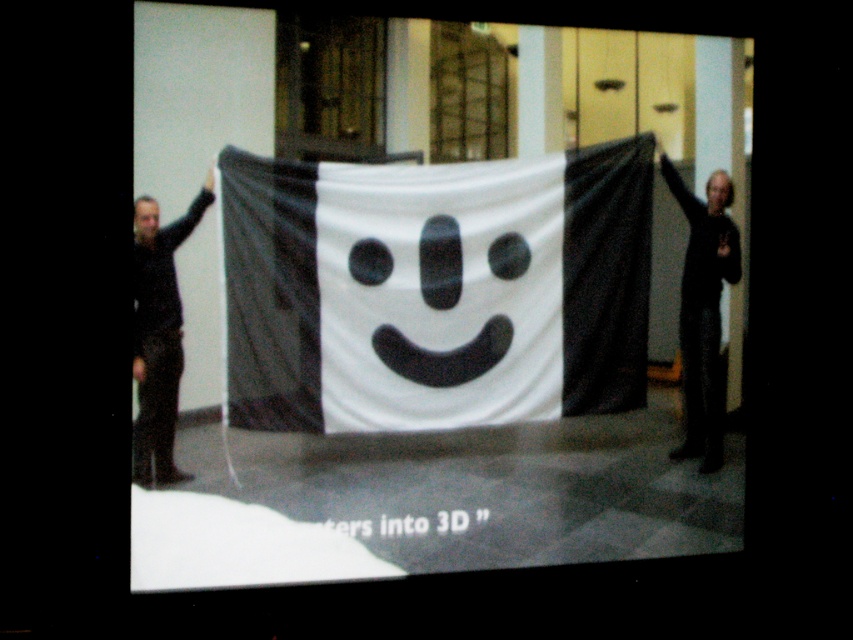
You are an event planner setting up a photo backdrop. The banner must be at least 2 meters tall to be effective. Given the height comparison between the white fabric banner at center and the black matte sweater at right, can you determine if the banner meets the required height?

The white fabric banner at center is much taller than the black matte sweater at right. Since the banner is significantly taller, it likely meets the 2 meter requirement for the photo backdrop.

You are an event planner arranging a photoshoot for the banner. You need to ensure that the black matte sweater at right and the black matte clothing at left are positioned so that their sizes are proportionate to each other. Which clothing item should be placed closer to the camera to maintain the correct size relationship?

The black matte sweater at right is smaller than the black matte clothing at left. To maintain proportion, the smaller black matte sweater at right should be placed closer to the camera so that it appears larger in the photo, matching the size of the black matte clothing at left.